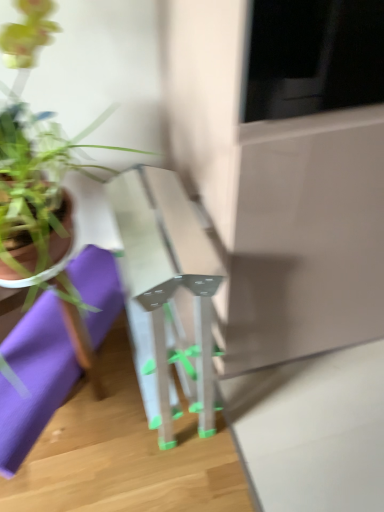
Find the location of a particular element. Image resolution: width=384 pixels, height=512 pixels. free space to the right of transparent plastic table at center is located at coordinates (312, 407).